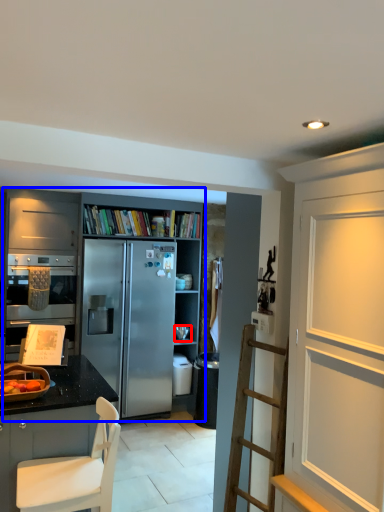
Question: Among these objects, which one is farthest to the camera, appliance (highlighted by a red box) or cabinetry (highlighted by a blue box)?

Choices:
 (A) appliance
 (B) cabinetry

Answer: (A)